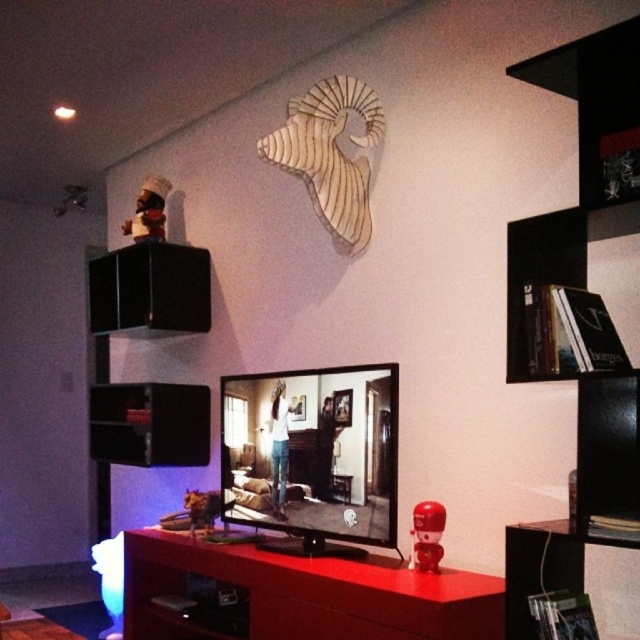
Question: Which object is closer to the camera taking this photo?

Choices:
 (A) matte red dresser at center
 (B) black matte shelf at center
 (C) smooth glossy tv at center
 (D) matte red robot at lower right

Answer: (A)

Question: Among these objects, which one is nearest to the camera?

Choices:
 (A) black matte shelf at center
 (B) matte red dresser at center
 (C) matte brown figurine at upper left
 (D) black plastic shelf at lower right

Answer: (D)

Question: Can you confirm if smooth glossy tv at center is bigger than wooden picture frame at upper center?

Choices:
 (A) no
 (B) yes

Answer: (B)

Question: Is black matte speaker at upper left closer to camera compared to black matte shelf at center?

Choices:
 (A) yes
 (B) no

Answer: (A)

Question: Which point is farther from the camera taking this photo?

Choices:
 (A) (288, 445)
 (B) (154, 218)

Answer: (B)

Question: Can you confirm if smooth glossy tv at center is thinner than black plastic shelf at lower right?

Choices:
 (A) no
 (B) yes

Answer: (A)